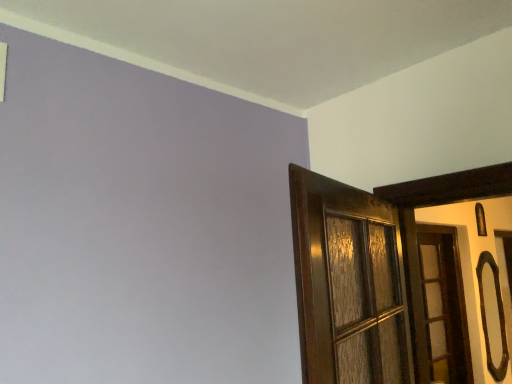
Question: Is black glossy door handle at right inside or outside of wooden door at right?

Choices:
 (A) inside
 (B) outside

Answer: (B)

Question: From the image's perspective, is black glossy door handle at right above or below wooden door at right?

Choices:
 (A) above
 (B) below

Answer: (B)

Question: Considering the positions of black glossy door handle at right and wooden door at right in the image, is black glossy door handle at right taller or shorter than wooden door at right?

Choices:
 (A) tall
 (B) short

Answer: (B)

Question: From their relative heights in the image, would you say wooden door at right is taller or shorter than black glossy door handle at right?

Choices:
 (A) tall
 (B) short

Answer: (A)

Question: Considering the positions of point (424, 269) and point (501, 352), is point (424, 269) closer or farther from the camera than point (501, 352)?

Choices:
 (A) farther
 (B) closer

Answer: (B)

Question: Is wooden door at right inside the boundaries of black glossy door handle at right, or outside?

Choices:
 (A) outside
 (B) inside

Answer: (A)

Question: Based on their positions, is wooden door at right located to the left or right of black glossy door handle at right?

Choices:
 (A) left
 (B) right

Answer: (A)